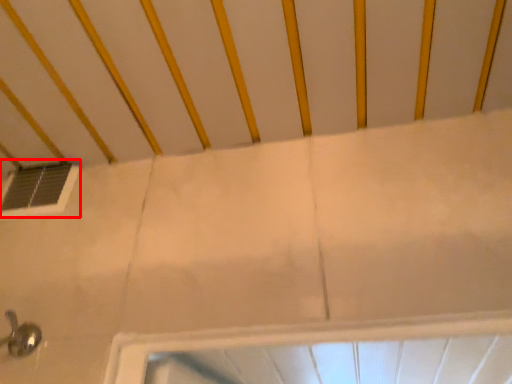
Question: From the image's perspective, where is window (annotated by the red box) located relative to infant bed?

Choices:
 (A) below
 (B) above

Answer: (A)